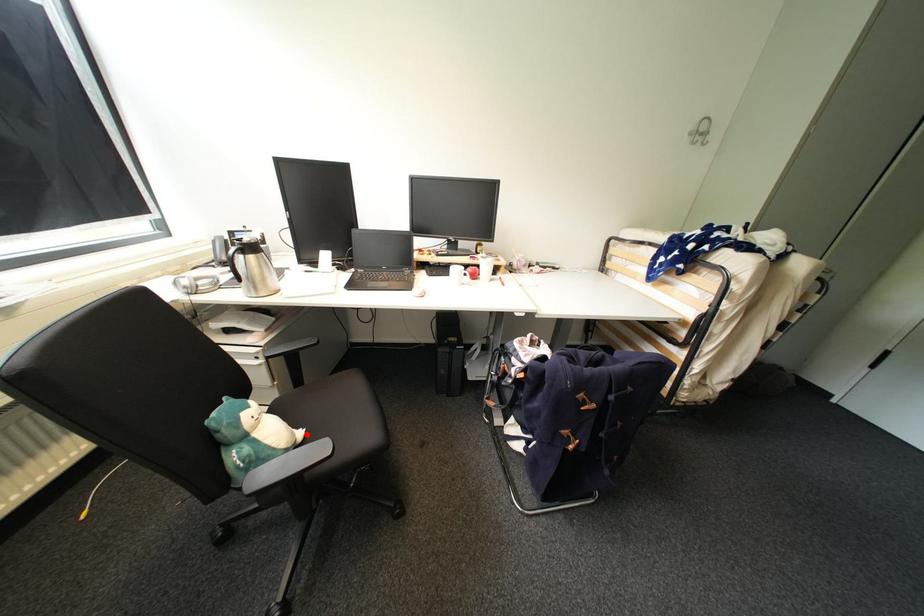
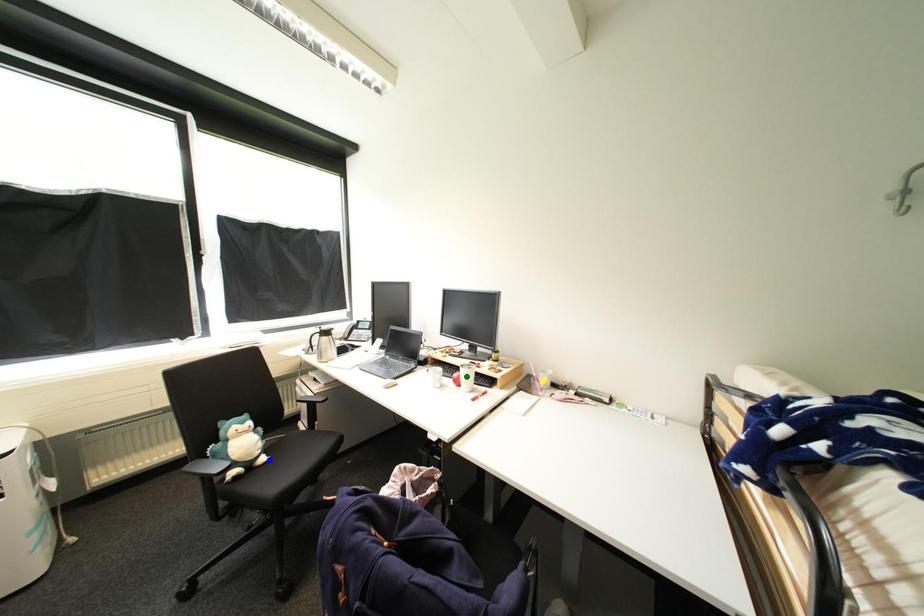
Question: I am providing you with two images of the same scene from different viewpoints. A red point is marked on the first image. You are given multiple points on the second image. In image 2, which mark is for the same physical point as the one in image 1?

Choices:
 (A) green point
 (B) yellow point
 (C) blue point

Answer: (C)